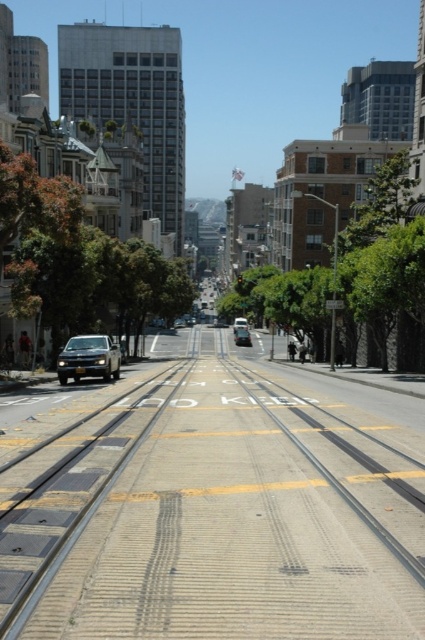
You are a pedestrian standing at the bottom of the hill on the street. You see a shiny silver suv at center and a shiny silver sedan at center. Which vehicle is higher up the hill?

The shiny silver suv at center is higher up the hill than the shiny silver sedan at center.